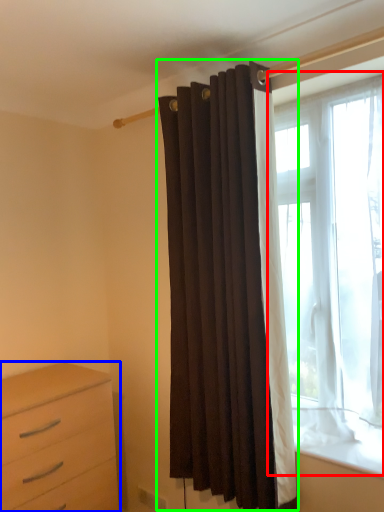
Question: Based on their relative distances, which object is nearer to window (highlighted by a red box)? Choose from chest of drawers (highlighted by a blue box) and curtain (highlighted by a green box).

Choices:
 (A) chest of drawers
 (B) curtain

Answer: (B)